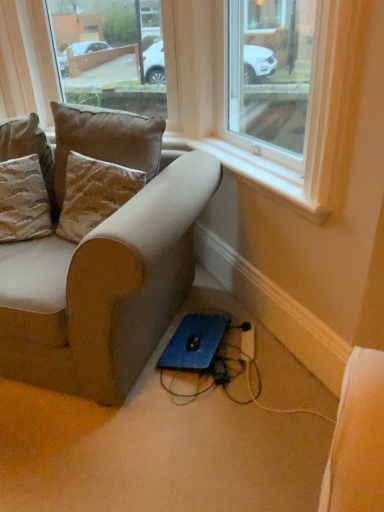
Question: Is textured beige pillow at upper left, which is the second pillow from right to left, not close to white plastic window sill at upper center?

Choices:
 (A) yes
 (B) no

Answer: (B)

Question: From a real-world perspective, is textured beige pillow at upper left, the first pillow in the left-to-right sequence, located beneath white plastic window sill at upper center?

Choices:
 (A) yes
 (B) no

Answer: (A)

Question: Is textured beige pillow at upper left, the first pillow in the left-to-right sequence, in front of white plastic window sill at upper center?

Choices:
 (A) yes
 (B) no

Answer: (B)

Question: From the image's perspective, does textured beige pillow at upper left, the first pillow in the left-to-right sequence, appear higher than white plastic window sill at upper center?

Choices:
 (A) yes
 (B) no

Answer: (B)

Question: Is textured beige pillow at upper left, which is the second pillow from right to left, touching white plastic window sill at upper center?

Choices:
 (A) yes
 (B) no

Answer: (B)

Question: Is velvet brown pillow at upper left, acting as the first pillow starting from the right, wider or thinner than blue matte laptop at lower center?

Choices:
 (A) wide
 (B) thin

Answer: (B)

Question: From the image's perspective, is velvet brown pillow at upper left, which is counted as the second pillow, starting from the left, positioned above or below blue matte laptop at lower center?

Choices:
 (A) above
 (B) below

Answer: (A)

Question: Would you say velvet brown pillow at upper left, acting as the first pillow starting from the right, is inside or outside blue matte laptop at lower center?

Choices:
 (A) inside
 (B) outside

Answer: (B)

Question: In the image, is velvet brown pillow at upper left, which is counted as the second pillow, starting from the left, on the left side or the right side of blue matte laptop at lower center?

Choices:
 (A) left
 (B) right

Answer: (A)

Question: Is velvet brown pillow at upper left, acting as the first pillow starting from the right, situated inside white plastic window sill at upper center or outside?

Choices:
 (A) outside
 (B) inside

Answer: (A)

Question: Is velvet brown pillow at upper left, acting as the first pillow starting from the right, to the left or to the right of white plastic window sill at upper center in the image?

Choices:
 (A) right
 (B) left

Answer: (B)

Question: From the image's perspective, is velvet brown pillow at upper left, acting as the first pillow starting from the right, positioned above or below white plastic window sill at upper center?

Choices:
 (A) above
 (B) below

Answer: (A)

Question: Is velvet brown pillow at upper left, which is counted as the second pillow, starting from the left, wider or thinner than white plastic window sill at upper center?

Choices:
 (A) thin
 (B) wide

Answer: (B)

Question: Would you say clear glass window at upper center, which is the first window from left to right, is to the left or to the right of velvet brown pillow at upper left, acting as the first pillow starting from the right, in the picture?

Choices:
 (A) left
 (B) right

Answer: (A)

Question: Based on their sizes in the image, would you say clear glass window at upper center, which is the first window from left to right, is bigger or smaller than velvet brown pillow at upper left, acting as the first pillow starting from the right?

Choices:
 (A) small
 (B) big

Answer: (B)